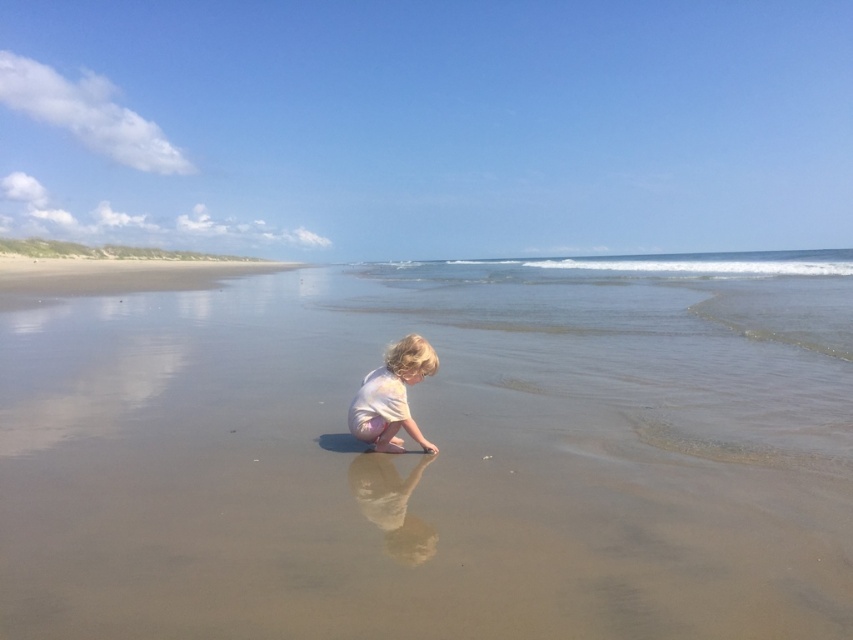
Question: Which of the following is the farthest from the observer?

Choices:
 (A) (511, 268)
 (B) (397, 355)

Answer: (A)

Question: Is smooth sand at center wider than light pink fabric toddler at center?

Choices:
 (A) no
 (B) yes

Answer: (B)

Question: Is the position of smooth sand at center more distant than that of light pink fabric toddler at center?

Choices:
 (A) no
 (B) yes

Answer: (A)

Question: Can you confirm if smooth sand at center is positioned to the left of light pink fabric toddler at center?

Choices:
 (A) yes
 (B) no

Answer: (B)

Question: Which point is closer to the camera taking this photo?

Choices:
 (A) (437, 486)
 (B) (387, 406)

Answer: (A)

Question: Which of the following is the closest to the observer?

Choices:
 (A) (326, 480)
 (B) (392, 417)

Answer: (A)